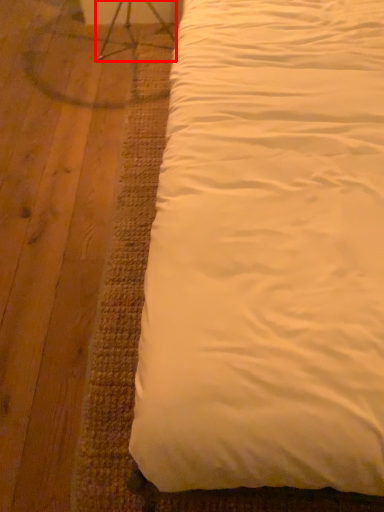
Question: From the image's perspective, considering the relative positions of swivel chair (annotated by the red box) and bed in the image provided, where is swivel chair (annotated by the red box) located with respect to the staircase?

Choices:
 (A) above
 (B) below

Answer: (A)